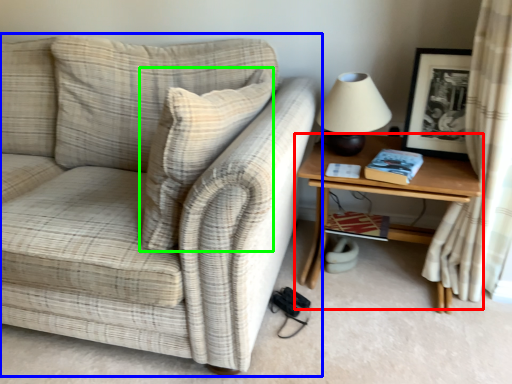
Question: Estimate the real-world distances between objects in this image. Which object is farther from table (highlighted by a red box), studio couch (highlighted by a blue box) or throw pillow (highlighted by a green box)?

Choices:
 (A) studio couch
 (B) throw pillow

Answer: (A)